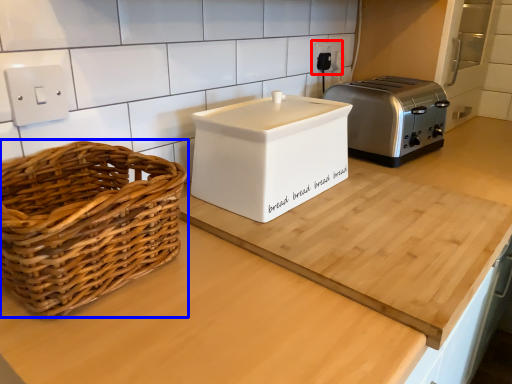
Question: Which point is closer to the camera, electric outlet (highlighted by a red box) or picnic basket (highlighted by a blue box)?

Choices:
 (A) electric outlet
 (B) picnic basket

Answer: (B)